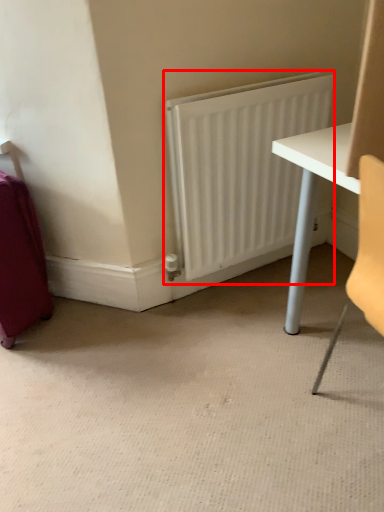
Question: From the image's perspective, considering the relative positions of radiator (annotated by the red box) and luggage in the image provided, where is radiator (annotated by the red box) located with respect to the staircase?

Choices:
 (A) below
 (B) above

Answer: (B)